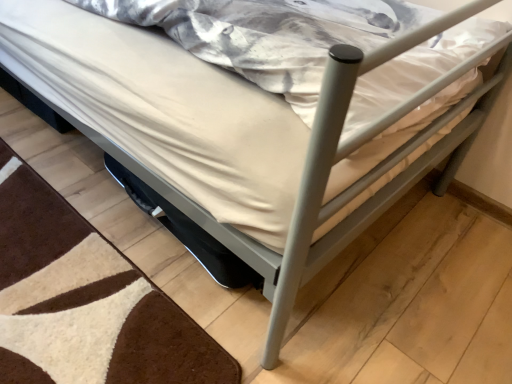
Locate an element on the screen. This screenshot has width=512, height=384. vacant point above brown textured mat at lower left (from a real-world perspective) is located at coordinates [65, 288].